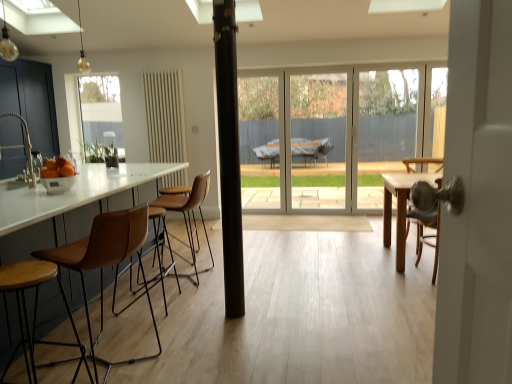
Question: Is brown leather stool at left at the back of transparent glass door at center?

Choices:
 (A) yes
 (B) no

Answer: (B)

Question: Is transparent glass door at center far away from brown leather stool at left?

Choices:
 (A) no
 (B) yes

Answer: (B)

Question: Does transparent glass door at center have a lesser height compared to brown leather stool at left?

Choices:
 (A) yes
 (B) no

Answer: (B)

Question: From the image's perspective, is transparent glass door at center below brown leather stool at left?

Choices:
 (A) no
 (B) yes

Answer: (A)

Question: Could brown leather stool at left be considered to be inside transparent glass door at center?

Choices:
 (A) yes
 (B) no

Answer: (B)

Question: From a real-world perspective, is transparent glass door at center on top of brown leather stool at left?

Choices:
 (A) yes
 (B) no

Answer: (A)

Question: Considering the relative sizes of matte black cabinets at left and brown leather stool at left in the image provided, is matte black cabinets at left bigger than brown leather stool at left?

Choices:
 (A) yes
 (B) no

Answer: (A)

Question: Is matte black cabinets at left shorter than brown leather stool at left?

Choices:
 (A) no
 (B) yes

Answer: (A)

Question: Considering the relative sizes of matte black cabinets at left and brown leather stool at left in the image provided, is matte black cabinets at left smaller than brown leather stool at left?

Choices:
 (A) no
 (B) yes

Answer: (A)

Question: Is the position of matte black cabinets at left less distant than that of brown leather stool at left?

Choices:
 (A) no
 (B) yes

Answer: (A)

Question: Can you confirm if matte black cabinets at left is thinner than brown leather stool at left?

Choices:
 (A) yes
 (B) no

Answer: (B)

Question: From a real-world perspective, does matte black cabinets at left sit lower than brown leather stool at left?

Choices:
 (A) no
 (B) yes

Answer: (A)

Question: Considering the relative positions of orange matte bowl at left and black matte pole at center in the image provided, is orange matte bowl at left to the left of black matte pole at center from the viewer's perspective?

Choices:
 (A) no
 (B) yes

Answer: (B)